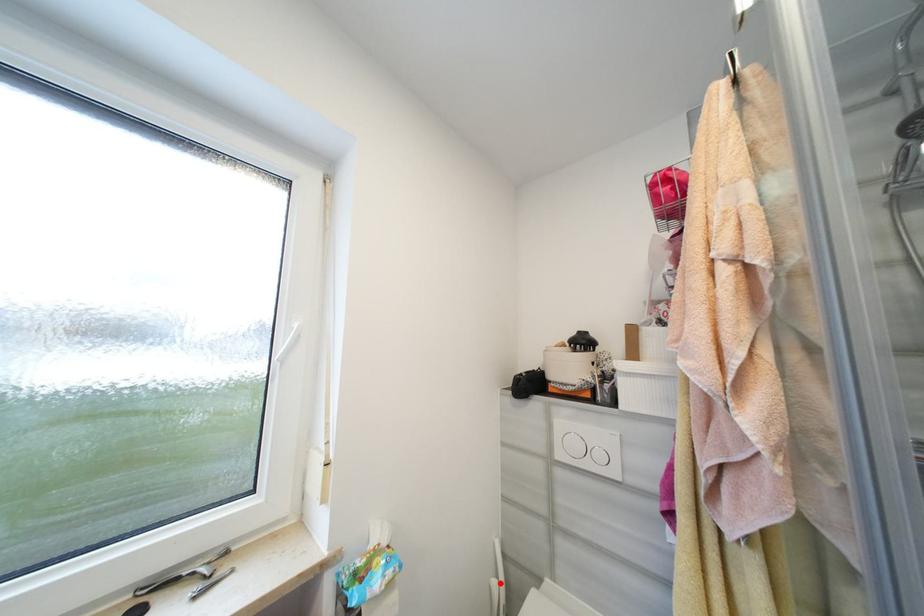
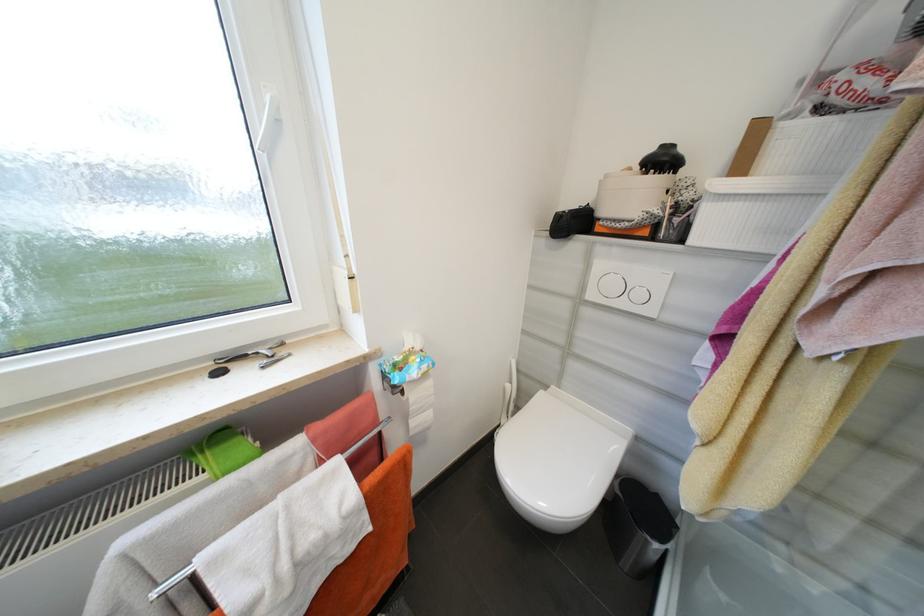
The point at the highlighted location is marked in the first image. Where is the corresponding point in the second image?

(514, 387)